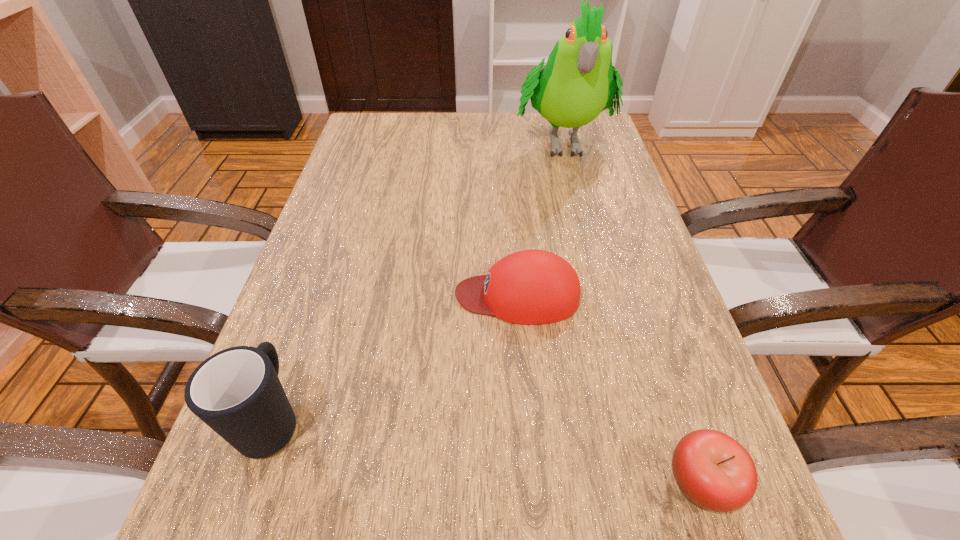
This screenshot has height=540, width=960. Identify the location of free location that satisfies the following two spatial constraints: 1. on the beak of the parakeet; 2. on the right side of the apple. (648, 482).

Find the location of `free point that satisfies the following two spatial constraints: 1. on the beak of the farthest object; 2. on the front-facing side of the second farthest object`. free point that satisfies the following two spatial constraints: 1. on the beak of the farthest object; 2. on the front-facing side of the second farthest object is located at coordinates (600, 295).